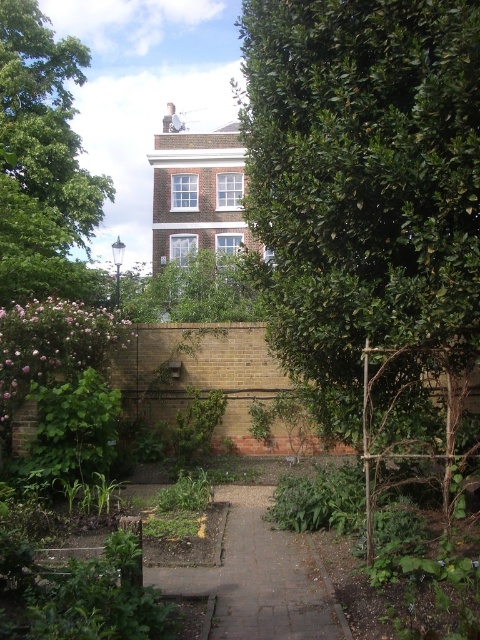
Who is positioned more to the left, green leafy tree at upper center or green leafy hedge at lower left?

Positioned to the left is green leafy tree at upper center.

Identify the location of green leafy tree at upper center. 41,161.

Is point (60, 154) behind point (111, 410)?

Yes, it is.

The height and width of the screenshot is (640, 480). Find the location of `green leafy tree at upper center`. green leafy tree at upper center is located at coordinates (41, 161).

Which is in front, point (226, 488) or point (46, 449)?

Point (46, 449) is more forward.

Where is `paved stone path at center`? The image size is (480, 640). paved stone path at center is located at coordinates (269, 577).

Can you confirm if green leafy tree at center is smaller than green leafy hedge at lower left?

No.

Does green leafy tree at center come in front of green leafy hedge at lower left?

Yes, it is in front of green leafy hedge at lower left.

Locate an element on the screen. green leafy tree at center is located at coordinates (371, 220).

Where is `green leafy tree at center`? The image size is (480, 640). green leafy tree at center is located at coordinates (371, 220).